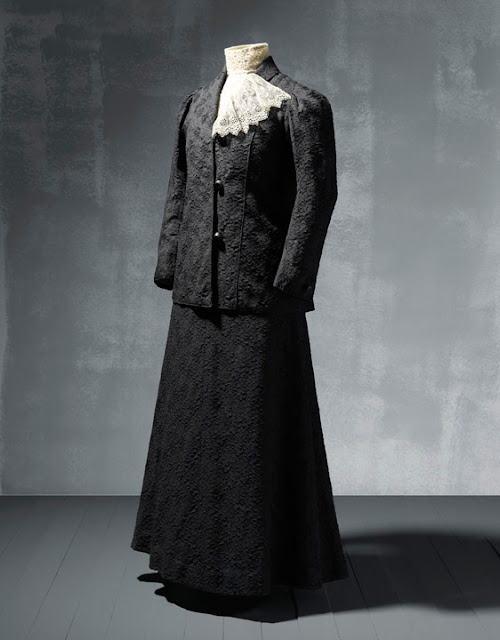
This screenshot has width=500, height=640. I want to click on gray wall, so click(433, 260).